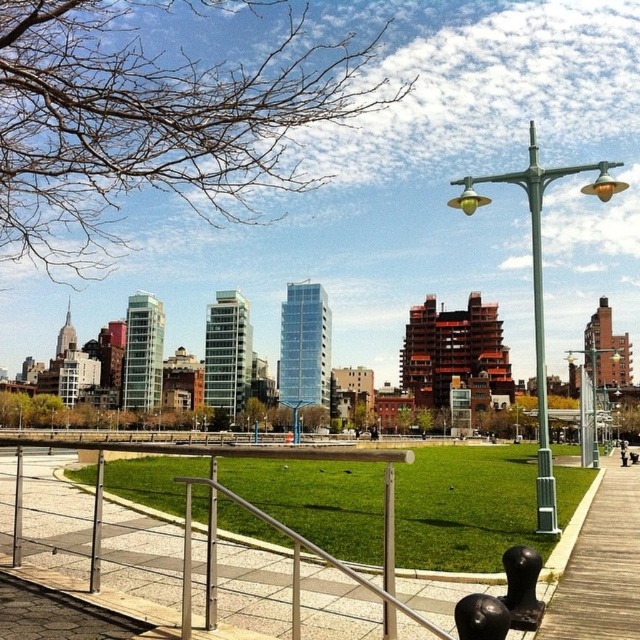
Question: Does green metallic lamp post at center-right appear on the left side of wooden park bench at center?

Choices:
 (A) yes
 (B) no

Answer: (B)

Question: Is the position of green metal lamp post at right less distant than that of green metallic lamp post at center-right?

Choices:
 (A) yes
 (B) no

Answer: (A)

Question: Among these points, which one is farthest from the camera?

Choices:
 (A) (637, 454)
 (B) (442, 624)
 (C) (592, 372)

Answer: (C)

Question: Considering the relative positions of green metallic lamp post at center-right and wooden park bench at center in the image provided, where is green metallic lamp post at center-right located with respect to wooden park bench at center?

Choices:
 (A) above
 (B) below

Answer: (A)

Question: Which object appears closest to the camera in this image?

Choices:
 (A) silver metallic rail at center
 (B) green metal lamp post at right
 (C) wooden boardwalk at lower right

Answer: (A)

Question: Which object is closer to the camera taking this photo?

Choices:
 (A) wooden park bench at center
 (B) silver metallic rail at center
 (C) green metallic lamp post at center-right
 (D) green metal lamp post at right

Answer: (B)